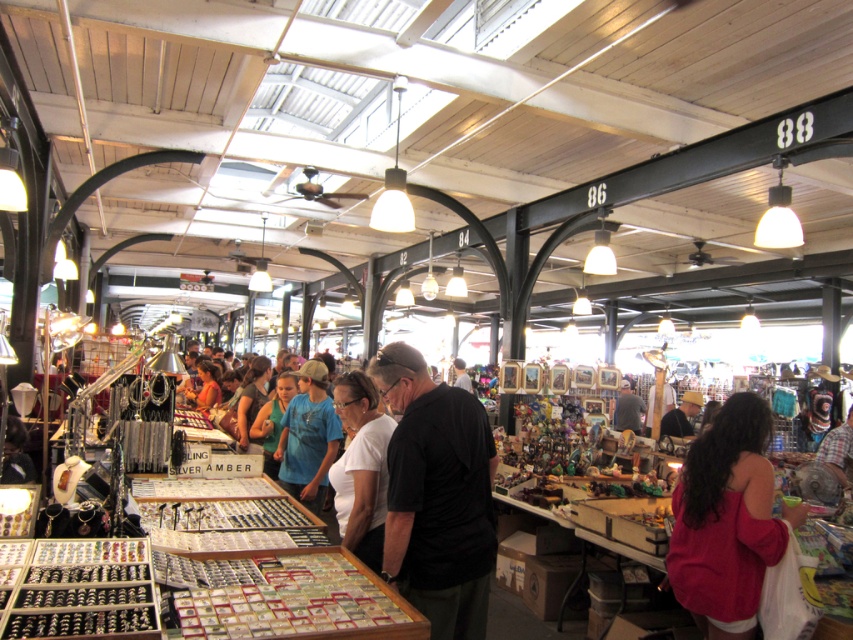
Does red matte sweater at lower right have a lesser height compared to gray fabric shirt at center?

In fact, red matte sweater at lower right may be taller than gray fabric shirt at center.

Does red matte sweater at lower right have a larger size compared to gray fabric shirt at center?

Actually, red matte sweater at lower right might be smaller than gray fabric shirt at center.

Find the location of a particular element. The height and width of the screenshot is (640, 853). red matte sweater at lower right is located at coordinates (724, 520).

The height and width of the screenshot is (640, 853). I want to click on red matte sweater at lower right, so click(x=724, y=520).

Is white matte shirt at center to the left of blue t-shirt at center from the viewer's perspective?

In fact, white matte shirt at center is to the right of blue t-shirt at center.

Is white matte shirt at center further to the viewer compared to blue t-shirt at center?

No, it is in front of blue t-shirt at center.

I want to click on white matte shirt at center, so click(361, 468).

Is red matte sweater at lower right bigger than blue t-shirt at center?

Actually, red matte sweater at lower right might be smaller than blue t-shirt at center.

At what (x,y) coordinates should I click in order to perform the action: click on red matte sweater at lower right. Please return your answer as a coordinate pair (x, y). This screenshot has height=640, width=853. Looking at the image, I should click on (724, 520).